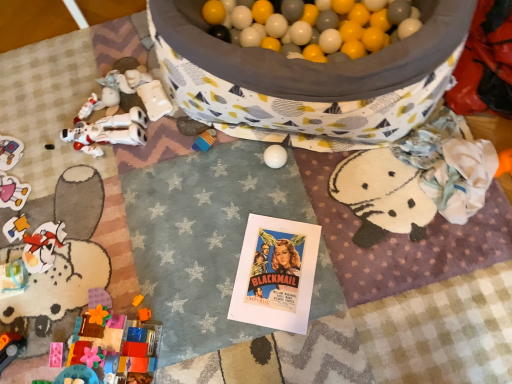
The height and width of the screenshot is (384, 512). What are the coordinates of `vacant area that is situated to the right of brick-like plastic blocks at lower left, arranged as the first toy when viewed from the front` in the screenshot? It's located at (192, 331).